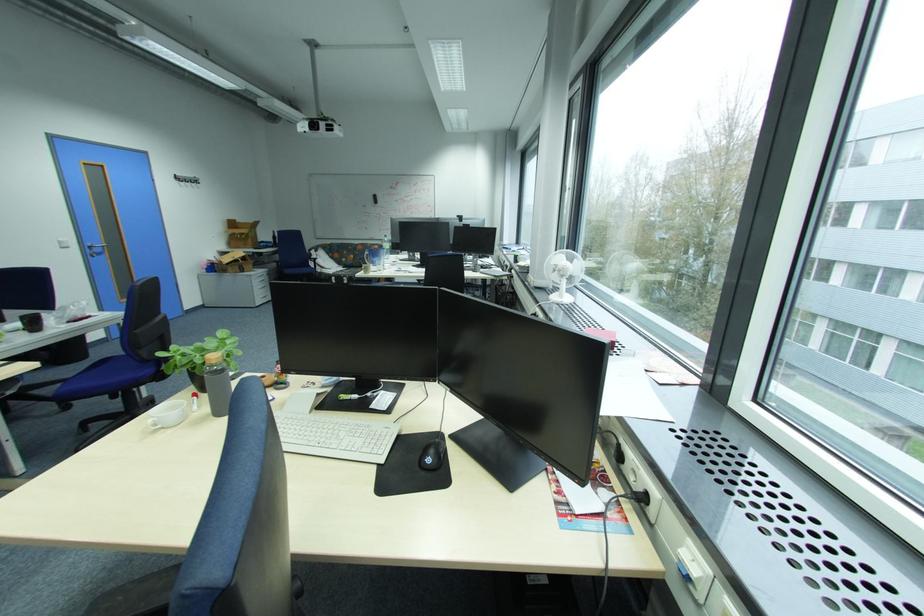
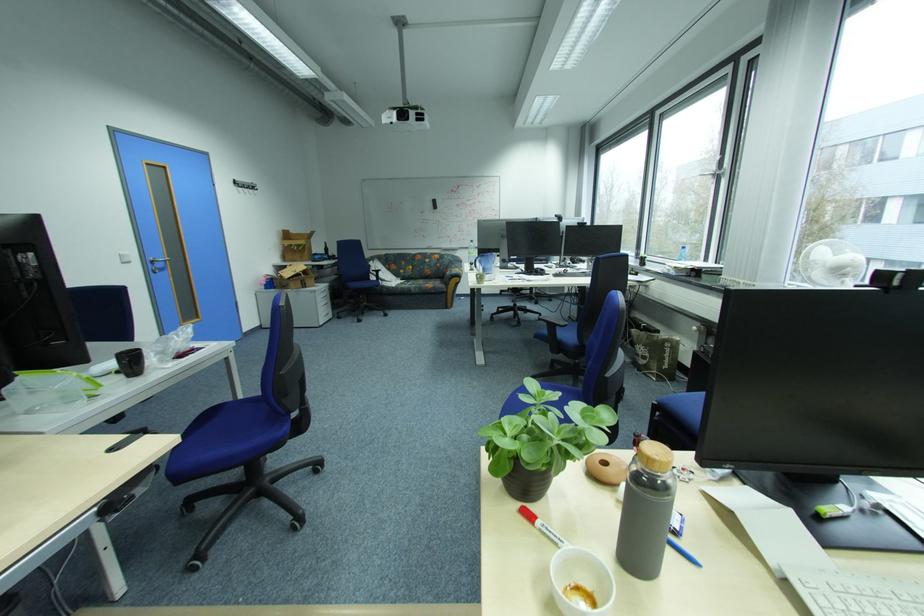
In the second image, find the point that corresponds to point (348, 275) in the first image.

(411, 286)